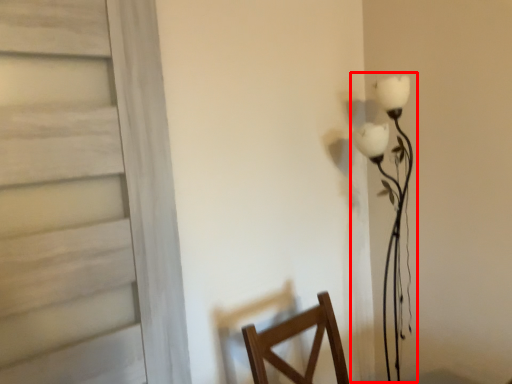
Question: Where is table lamp (annotated by the red box) located in relation to door in the image?

Choices:
 (A) left
 (B) right

Answer: (B)